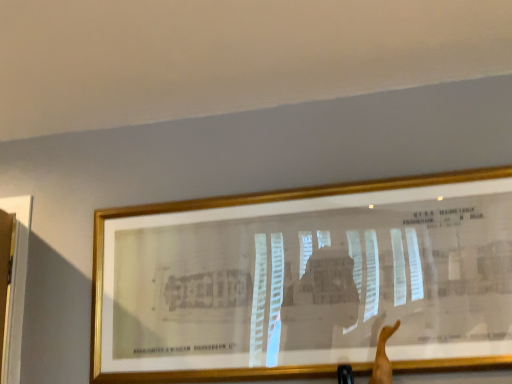
The image size is (512, 384). Find the location of `gold metallic picture frame at upper center`. gold metallic picture frame at upper center is located at coordinates (306, 280).

Image resolution: width=512 pixels, height=384 pixels. What do you see at coordinates (306, 280) in the screenshot? I see `gold metallic picture frame at upper center` at bounding box center [306, 280].

Find the location of `skinny tan arm at lower right`. skinny tan arm at lower right is located at coordinates (383, 357).

Measure the distance between skinny tan arm at lower right and camera.

4.27 feet.

Describe the element at coordinates (383, 357) in the screenshot. This screenshot has width=512, height=384. I see `skinny tan arm at lower right` at that location.

What is the approximate width of skinny tan arm at lower right?

skinny tan arm at lower right is 3.32 inches in width.

In order to face skinny tan arm at lower right, should I rotate leftwards or rightwards?

Turn right by 16.383 degrees to look at skinny tan arm at lower right.

Identify the location of gold metallic picture frame at upper center. Image resolution: width=512 pixels, height=384 pixels. pyautogui.click(x=306, y=280).

Is gold metallic picture frame at upper center at the right side of skinny tan arm at lower right?

No, gold metallic picture frame at upper center is not to the right of skinny tan arm at lower right.

Is gold metallic picture frame at upper center further to camera compared to skinny tan arm at lower right?

Yes, gold metallic picture frame at upper center is further from the viewer.

Is point (493, 291) closer or farther from the camera than point (390, 365)?

Point (493, 291) is farther from the camera than point (390, 365).

From the image's perspective, would you say gold metallic picture frame at upper center is shown under skinny tan arm at lower right?

Actually, gold metallic picture frame at upper center appears above skinny tan arm at lower right in the image.

From a real-world perspective, is gold metallic picture frame at upper center positioned under skinny tan arm at lower right based on gravity?

No.

Between gold metallic picture frame at upper center and skinny tan arm at lower right, which one has smaller width?

skinny tan arm at lower right is thinner.

Considering the relative sizes of gold metallic picture frame at upper center and skinny tan arm at lower right in the image provided, is gold metallic picture frame at upper center shorter than skinny tan arm at lower right?

Incorrect, the height of gold metallic picture frame at upper center does not fall short of that of skinny tan arm at lower right.

Can you confirm if gold metallic picture frame at upper center is smaller than skinny tan arm at lower right?

Actually, gold metallic picture frame at upper center might be larger than skinny tan arm at lower right.

Is gold metallic picture frame at upper center spatially inside skinny tan arm at lower right, or outside of it?

gold metallic picture frame at upper center is not enclosed by skinny tan arm at lower right.

Is gold metallic picture frame at upper center far away from skinny tan arm at lower right?

Actually, gold metallic picture frame at upper center and skinny tan arm at lower right are a little close together.

Could you tell me if gold metallic picture frame at upper center is facing skinny tan arm at lower right?

Yes, gold metallic picture frame at upper center is turned towards skinny tan arm at lower right.

Can you tell me how much gold metallic picture frame at upper center and skinny tan arm at lower right differ in facing direction?

3.34e-05 degrees separate the facing orientations of gold metallic picture frame at upper center and skinny tan arm at lower right.

Measure the distance between gold metallic picture frame at upper center and skinny tan arm at lower right.

gold metallic picture frame at upper center is 17.86 inches away from skinny tan arm at lower right.

The height and width of the screenshot is (384, 512). Identify the location of arm directly beneath the gold metallic picture frame at upper center (from a real-world perspective). (383, 357).

Which is more to the left, skinny tan arm at lower right or gold metallic picture frame at upper center?

Positioned to the left is gold metallic picture frame at upper center.

Relative to gold metallic picture frame at upper center, is skinny tan arm at lower right in front or behind?

In the image, skinny tan arm at lower right appears in front of gold metallic picture frame at upper center.

Considering the points (379, 352) and (288, 280), which point is behind, point (379, 352) or point (288, 280)?

Positioned behind is point (288, 280).

From the image's perspective, which is below, skinny tan arm at lower right or gold metallic picture frame at upper center?

From the image's view, skinny tan arm at lower right is below.

From a real-world perspective, is skinny tan arm at lower right positioned above or below gold metallic picture frame at upper center?

From a real-world perspective, skinny tan arm at lower right is physically below gold metallic picture frame at upper center.

Does skinny tan arm at lower right have a lesser width compared to gold metallic picture frame at upper center?

Correct, the width of skinny tan arm at lower right is less than that of gold metallic picture frame at upper center.

Is skinny tan arm at lower right taller than gold metallic picture frame at upper center?

No.

Between skinny tan arm at lower right and gold metallic picture frame at upper center, which one has larger size?

Bigger between the two is gold metallic picture frame at upper center.

Is skinny tan arm at lower right completely or partially outside of gold metallic picture frame at upper center?

skinny tan arm at lower right is positioned outside gold metallic picture frame at upper center.

Is skinny tan arm at lower right next to gold metallic picture frame at upper center and touching it?

No.

Does skinny tan arm at lower right turn towards gold metallic picture frame at upper center?

No, skinny tan arm at lower right is not turned towards gold metallic picture frame at upper center.

Can you tell me how much skinny tan arm at lower right and gold metallic picture frame at upper center differ in facing direction?

The facing directions of skinny tan arm at lower right and gold metallic picture frame at upper center are 3.34e-05 degrees apart.

In order to click on picture frame above the skinny tan arm at lower right (from a real-world perspective) in this screenshot , I will do `click(306, 280)`.

Locate an element on the screen. picture frame above the skinny tan arm at lower right (from a real-world perspective) is located at coordinates (306, 280).

Locate an element on the screen. arm beneath the gold metallic picture frame at upper center (from a real-world perspective) is located at coordinates (383, 357).